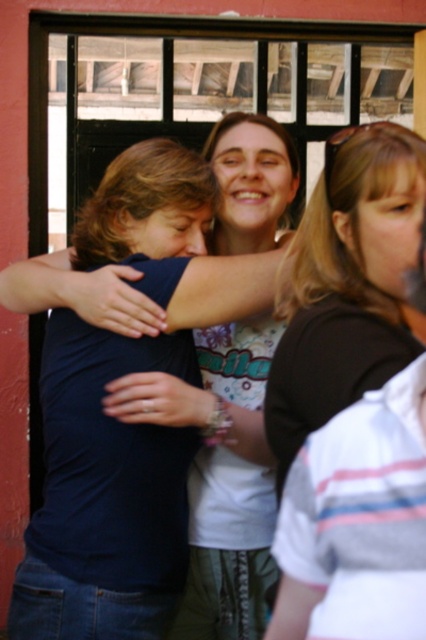
Question: Does matte black shirt at center have a smaller size compared to white striped shirt at right?

Choices:
 (A) no
 (B) yes

Answer: (A)

Question: Which object is closer to the camera taking this photo?

Choices:
 (A) matte black shirt at center
 (B) dark blue shirt at center

Answer: (A)

Question: Which point is closer to the camera taking this photo?

Choices:
 (A) (51, 445)
 (B) (241, 496)

Answer: (B)

Question: Which point is closer to the camera?

Choices:
 (A) (400, 198)
 (B) (192, 548)
 (C) (57, 392)

Answer: (A)

Question: Can you confirm if dark blue shirt at center is wider than white striped shirt at right?

Choices:
 (A) yes
 (B) no

Answer: (A)

Question: Observing the image, what is the correct spatial positioning of dark blue shirt at center in reference to white striped shirt at right?

Choices:
 (A) left
 (B) right

Answer: (A)